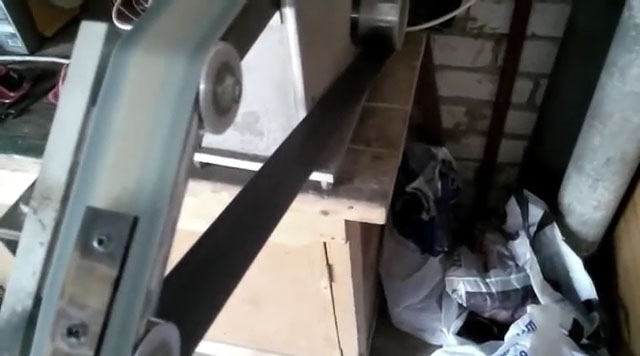
Identify the location of door. (358, 286).